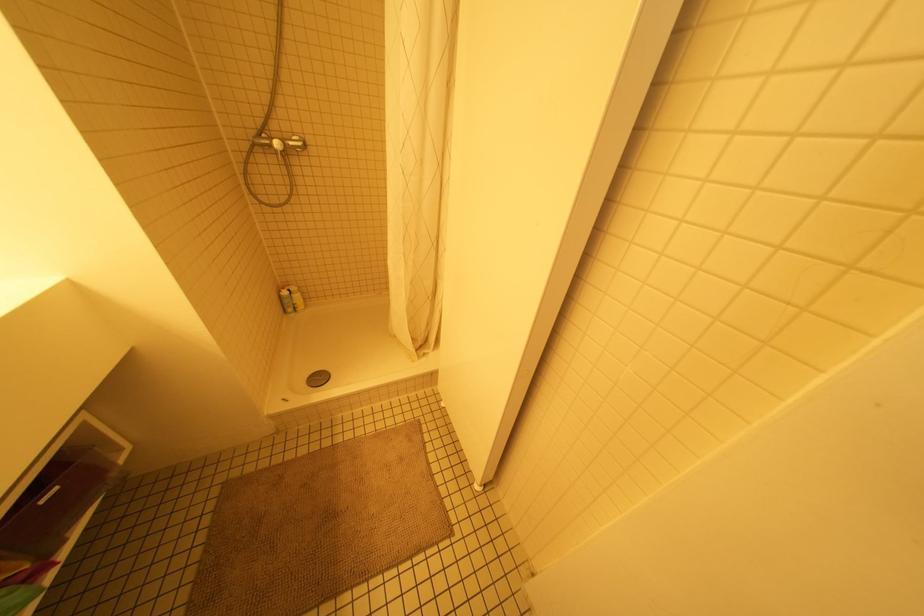
Where is `small green bottle`? This screenshot has width=924, height=616. small green bottle is located at coordinates (286, 301).